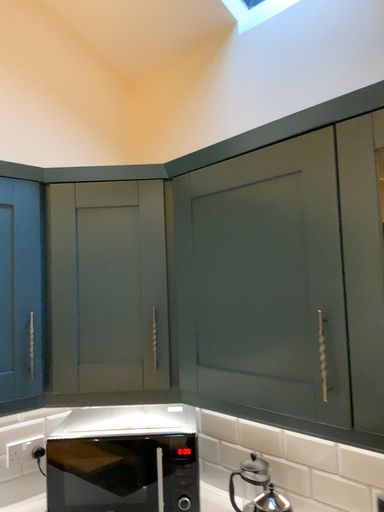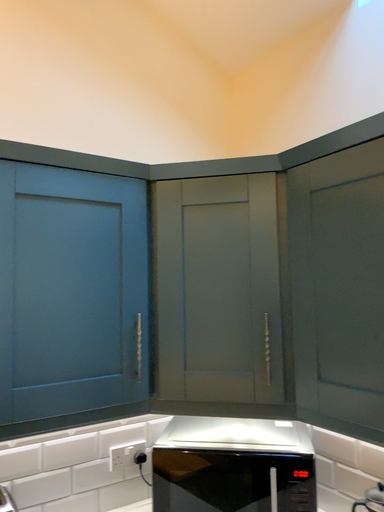
Question: How did the camera likely rotate when shooting the video?

Choices:
 (A) rotated left
 (B) rotated right

Answer: (A)